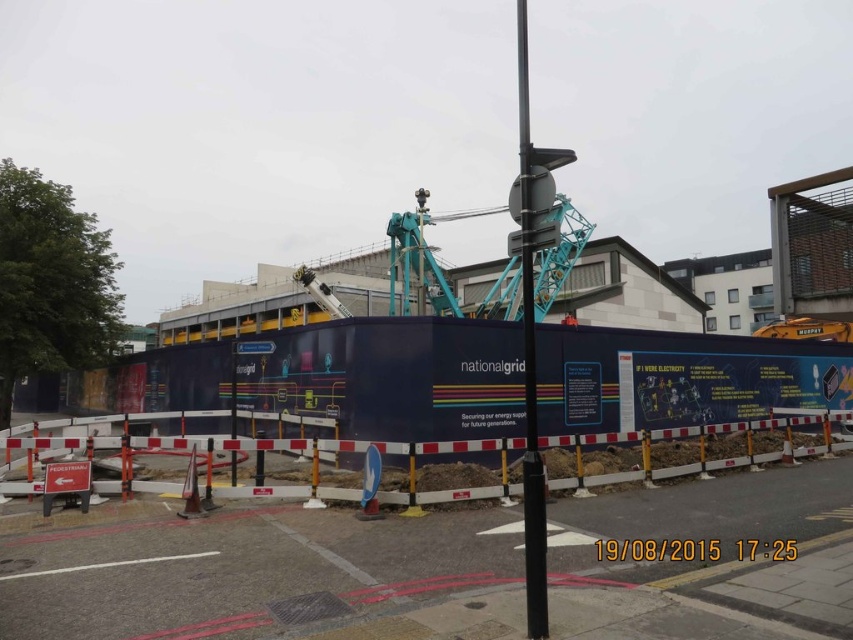
Does black metal pole at center appear under orange fabric construction worker at center?

No, black metal pole at center is not below orange fabric construction worker at center.

Is black metal pole at center to the left of orange fabric construction worker at center from the viewer's perspective?

In fact, black metal pole at center is to the right of orange fabric construction worker at center.

This screenshot has height=640, width=853. What are the coordinates of `black metal pole at center` in the screenshot? It's located at (531, 368).

Is white plastic sign at center in front of orange fabric construction worker at center?

Yes.

Who is positioned more to the right, white plastic sign at center or orange fabric construction worker at center?

Positioned to the right is orange fabric construction worker at center.

What do you see at coordinates (254, 348) in the screenshot? This screenshot has width=853, height=640. I see `white plastic sign at center` at bounding box center [254, 348].

Find the location of a particular element. The width and height of the screenshot is (853, 640). white plastic sign at center is located at coordinates (254, 348).

Consider the image. Is dark blue painted wall at center below black metal pole at center?

Indeed, dark blue painted wall at center is positioned under black metal pole at center.

Which is behind, point (265, 385) or point (526, 476)?

Positioned behind is point (265, 385).

This screenshot has height=640, width=853. Find the location of `dark blue painted wall at center`. dark blue painted wall at center is located at coordinates (337, 378).

At what (x,y) coordinates should I click in order to perform the action: click on dark blue painted wall at center. Please return your answer as a coordinate pair (x, y). The image size is (853, 640). Looking at the image, I should click on (337, 378).